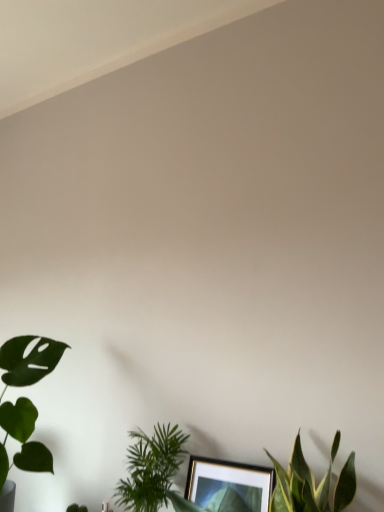
What do you see at coordinates (25, 400) in the screenshot?
I see `green matte leaf at lower left, which is the 3th houseplant in right-to-left order` at bounding box center [25, 400].

This screenshot has width=384, height=512. I want to click on green leafy plant at lower center, which is the 3th houseplant in left-to-right order, so click(x=301, y=483).

Locate an element on the screen. This screenshot has width=384, height=512. green leafy plant at lower left is located at coordinates (76, 508).

Is green leafy plant at lower center, which is the 3th houseplant in left-to-right order, positioned before green leafy plant at lower left?

Yes, green leafy plant at lower center, which is the 3th houseplant in left-to-right order, is in front of green leafy plant at lower left.

Consider the image. Considering the sizes of objects green leafy plant at lower center, positioned as the first houseplant in right-to-left order, and green leafy plant at lower left in the image provided, who is thinner, green leafy plant at lower center, positioned as the first houseplant in right-to-left order, or green leafy plant at lower left?

green leafy plant at lower left is thinner.

Can you confirm if green leafy plant at lower center, which is the 3th houseplant in left-to-right order, is bigger than green leafy plant at lower left?

Indeed, green leafy plant at lower center, which is the 3th houseplant in left-to-right order, has a larger size compared to green leafy plant at lower left.

How many degrees apart are the facing directions of green leafy plant at lower center, which is the 3th houseplant in left-to-right order, and green leafy plant at lower left?

The angular difference between green leafy plant at lower center, which is the 3th houseplant in left-to-right order, and green leafy plant at lower left is 25.1 degrees.

From the image's perspective, relative to green leafy plant at lower center, arranged as the second houseplant when viewed from the right, is green leafy plant at lower center, which is the 3th houseplant in left-to-right order, above or below?

From the image's perspective, green leafy plant at lower center, which is the 3th houseplant in left-to-right order, appears above green leafy plant at lower center, arranged as the second houseplant when viewed from the right.

Is green leafy plant at lower center, positioned as the first houseplant in right-to-left order, positioned behind green leafy plant at lower center, arranged as the second houseplant when viewed from the right?

That is False.

Is green leafy plant at lower center, positioned as the first houseplant in right-to-left order, oriented towards green leafy plant at lower center, arranged as the second houseplant when viewed from the right?

No, green leafy plant at lower center, positioned as the first houseplant in right-to-left order, does not turn towards green leafy plant at lower center, arranged as the second houseplant when viewed from the right.

How many degrees apart are the facing directions of green leafy plant at lower center, which is the 3th houseplant in left-to-right order, and green leafy plant at lower center, placed as the second houseplant when sorted from left to right?

There is a 0.000343-degree angle between the facing directions of green leafy plant at lower center, which is the 3th houseplant in left-to-right order, and green leafy plant at lower center, placed as the second houseplant when sorted from left to right.

Is green leafy plant at lower center, arranged as the second houseplant when viewed from the right, turned away from green leafy plant at lower left?

green leafy plant at lower center, arranged as the second houseplant when viewed from the right, is not turned away from green leafy plant at lower left.

From the image's perspective, is green leafy plant at lower center, arranged as the second houseplant when viewed from the right, under green leafy plant at lower left?

No.

Which object is positioned more to the left, green leafy plant at lower center, arranged as the second houseplant when viewed from the right, or green leafy plant at lower left?

Positioned to the left is green leafy plant at lower left.

Is green leafy plant at lower center, which is the 3th houseplant in left-to-right order, not close to green matte leaf at lower left, which is the 3th houseplant in right-to-left order?

No, green leafy plant at lower center, which is the 3th houseplant in left-to-right order, is not far from green matte leaf at lower left, which is the 3th houseplant in right-to-left order.

How many degrees apart are the facing directions of green leafy plant at lower center, positioned as the first houseplant in right-to-left order, and green matte leaf at lower left, placed as the first houseplant when sorted from left to right?

6.77e-05 degrees.

From the image's perspective, which is below, green leafy plant at lower center, which is the 3th houseplant in left-to-right order, or green matte leaf at lower left, which is the 3th houseplant in right-to-left order?

green matte leaf at lower left, which is the 3th houseplant in right-to-left order, appears lower in the image.

Who is smaller, green matte leaf at lower left, which is the 3th houseplant in right-to-left order, or green leafy plant at lower center, which is the 3th houseplant in left-to-right order?

green leafy plant at lower center, which is the 3th houseplant in left-to-right order.

From the image's perspective, between green matte leaf at lower left, which is the 3th houseplant in right-to-left order, and green leafy plant at lower center, positioned as the first houseplant in right-to-left order, which one is located above?

green leafy plant at lower center, positioned as the first houseplant in right-to-left order, appears higher in the image.

Is green matte leaf at lower left, placed as the first houseplant when sorted from left to right, looking in the opposite direction of green leafy plant at lower center, positioned as the first houseplant in right-to-left order?

green matte leaf at lower left, placed as the first houseplant when sorted from left to right, does not have its back to green leafy plant at lower center, positioned as the first houseplant in right-to-left order.

Are green matte leaf at lower left, which is the 3th houseplant in right-to-left order, and green leafy plant at lower center, which is the 3th houseplant in left-to-right order, located far from each other?

Actually, green matte leaf at lower left, which is the 3th houseplant in right-to-left order, and green leafy plant at lower center, which is the 3th houseplant in left-to-right order, are a little close together.

At what (x,y) coordinates should I click in order to perform the action: click on the 2nd houseplant to the right when counting from the green leafy plant at lower left. Please return your answer as a coordinate pair (x, y). The image size is (384, 512). Looking at the image, I should click on (301, 483).

Which object is further away from the camera taking this photo, green leafy plant at lower left or green leafy plant at lower center, which is the 3th houseplant in left-to-right order?

green leafy plant at lower left is behind.

Are green leafy plant at lower left and green leafy plant at lower center, positioned as the first houseplant in right-to-left order, located far from each other?

green leafy plant at lower left is near green leafy plant at lower center, positioned as the first houseplant in right-to-left order, not far away.

Is green matte leaf at lower left, which is the 3th houseplant in right-to-left order, outside of green leafy plant at lower center, arranged as the second houseplant when viewed from the right?

That's correct, green matte leaf at lower left, which is the 3th houseplant in right-to-left order, is outside of green leafy plant at lower center, arranged as the second houseplant when viewed from the right.

Is point (27, 456) farther from viewer compared to point (171, 465)?

Yes, point (27, 456) is behind point (171, 465).

Consider the image. Who is shorter, green matte leaf at lower left, placed as the first houseplant when sorted from left to right, or green leafy plant at lower center, placed as the second houseplant when sorted from left to right?

green leafy plant at lower center, placed as the second houseplant when sorted from left to right, is shorter.

Is green matte leaf at lower left, which is the 3th houseplant in right-to-left order, oriented towards green leafy plant at lower center, placed as the second houseplant when sorted from left to right?

No, green matte leaf at lower left, which is the 3th houseplant in right-to-left order, is not turned towards green leafy plant at lower center, placed as the second houseplant when sorted from left to right.

Which houseplant is the 3rd one when counting from the front of the green leafy plant at lower left? Please provide its 2D coordinates.

[(301, 483)]

This screenshot has width=384, height=512. Identify the location of houseplant below the green leafy plant at lower center, which is the 3th houseplant in left-to-right order (from a real-world perspective). (151, 468).

Consider the image. From the image, which object appears to be nearer to green leafy plant at lower center, positioned as the first houseplant in right-to-left order, green leafy plant at lower left or green leafy plant at lower center, placed as the second houseplant when sorted from left to right?

Among the two, green leafy plant at lower center, placed as the second houseplant when sorted from left to right, is located nearer to green leafy plant at lower center, positioned as the first houseplant in right-to-left order.

When comparing their distances from green matte leaf at lower left, which is the 3th houseplant in right-to-left order, does green leafy plant at lower center, which is the 3th houseplant in left-to-right order, or green leafy plant at lower center, arranged as the second houseplant when viewed from the right, seem closer?

Based on the image, green leafy plant at lower center, arranged as the second houseplant when viewed from the right, appears to be nearer to green matte leaf at lower left, which is the 3th houseplant in right-to-left order.

Based on their spatial positions, is green matte leaf at lower left, which is the 3th houseplant in right-to-left order, or green leafy plant at lower center, placed as the second houseplant when sorted from left to right, further from green leafy plant at lower left?

Based on the image, green matte leaf at lower left, which is the 3th houseplant in right-to-left order, appears to be further to green leafy plant at lower left.

Based on their spatial positions, is green matte leaf at lower left, which is the 3th houseplant in right-to-left order, or green leafy plant at lower center, arranged as the second houseplant when viewed from the right, closer to green leafy plant at lower center, positioned as the first houseplant in right-to-left order?

Based on the image, green leafy plant at lower center, arranged as the second houseplant when viewed from the right, appears to be nearer to green leafy plant at lower center, positioned as the first houseplant in right-to-left order.

Which object lies further to the anchor point green leafy plant at lower center, which is the 3th houseplant in left-to-right order, green matte leaf at lower left, which is the 3th houseplant in right-to-left order, or green leafy plant at lower left?

green leafy plant at lower left is positioned further to the anchor green leafy plant at lower center, which is the 3th houseplant in left-to-right order.

When comparing their distances from green leafy plant at lower center, placed as the second houseplant when sorted from left to right, does green matte leaf at lower left, which is the 3th houseplant in right-to-left order, or green leafy plant at lower center, positioned as the first houseplant in right-to-left order, seem further?

green leafy plant at lower center, positioned as the first houseplant in right-to-left order, is further to green leafy plant at lower center, placed as the second houseplant when sorted from left to right.

Looking at the image, which one is located closer to green matte leaf at lower left, placed as the first houseplant when sorted from left to right, green leafy plant at lower center, positioned as the first houseplant in right-to-left order, or green leafy plant at lower left?

green leafy plant at lower left.

When comparing their distances from green leafy plant at lower left, does green leafy plant at lower center, positioned as the first houseplant in right-to-left order, or green leafy plant at lower center, placed as the second houseplant when sorted from left to right, seem closer?

Among the two, green leafy plant at lower center, placed as the second houseplant when sorted from left to right, is located nearer to green leafy plant at lower left.

You are a GUI agent. You are given a task and a screenshot of the screen. Output one action in this format:
    pyautogui.click(x=<x>, y=<y>)
    Task: Click on the houseplant situated between green leafy plant at lower left and green leafy plant at lower center, which is the 3th houseplant in left-to-right order, from left to right
    
    Given the screenshot: What is the action you would take?
    pyautogui.click(x=151, y=468)

What are the coordinates of `plant between green matte leaf at lower left, which is the 3th houseplant in right-to-left order, and green leafy plant at lower center, which is the 3th houseplant in left-to-right order, in the horizontal direction` in the screenshot? It's located at (76, 508).

You are a GUI agent. You are given a task and a screenshot of the screen. Output one action in this format:
    pyautogui.click(x=<x>, y=<y>)
    Task: Click on the houseplant situated between green matte leaf at lower left, placed as the first houseplant when sorted from left to right, and green leafy plant at lower center, positioned as the first houseplant in right-to-left order, from left to right
    This screenshot has width=384, height=512.
    Given the screenshot: What is the action you would take?
    pyautogui.click(x=151, y=468)

Locate an element on the screen. The height and width of the screenshot is (512, 384). plant between green matte leaf at lower left, which is the 3th houseplant in right-to-left order, and green leafy plant at lower center, placed as the second houseplant when sorted from left to right, from left to right is located at coordinates (76, 508).